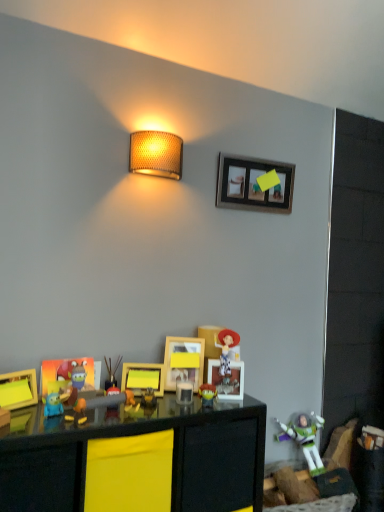
Question: From a real-world perspective, relative to matte plastic toy at center, arranged as the third toy when viewed from the top, is yellow matte picture frame at center, the 3th picture frame viewed from the front, vertically above or below?

Choices:
 (A) above
 (B) below

Answer: (A)

Question: Considering the positions of yellow matte picture frame at center, placed as the 3th picture frame when sorted from right to left, and matte plastic toy at center, arranged as the 2th toy when viewed from the right, in the image, is yellow matte picture frame at center, placed as the 3th picture frame when sorted from right to left, wider or thinner than matte plastic toy at center, arranged as the 2th toy when viewed from the right,?

Choices:
 (A) wide
 (B) thin

Answer: (A)

Question: Estimate the real-world distances between objects in this image. Which object is closer to the woven beige lampshade at upper center?

Choices:
 (A) wooden picture frame at upper center, the first picture frame in the right-to-left sequence
 (B) yellow matte picture frame at center, the fourth picture frame viewed from the left
 (C) matte plastic toy at center, positioned as the third toy in front-to-back order
 (D) matte plastic toy at center, positioned as the 3th toy in left-to-right order
 (E) plastic buzz lightyear at lower right, arranged as the 4th toy when viewed from the front

Answer: (A)

Question: Based on their relative distances, which object is farther from the woven beige lampshade at upper center?

Choices:
 (A) matte yellow picture frame at lower left, the first picture frame from the left
 (B) wooden picture frame at upper center, marked as the first picture frame in a back-to-front arrangement
 (C) plastic buzz lightyear at lower right, arranged as the 4th toy when viewed from the front
 (D) matte plastic picture frame at lower left, which is counted as the fourth picture frame, starting from the right
 (E) black glossy table at lower center

Answer: (C)